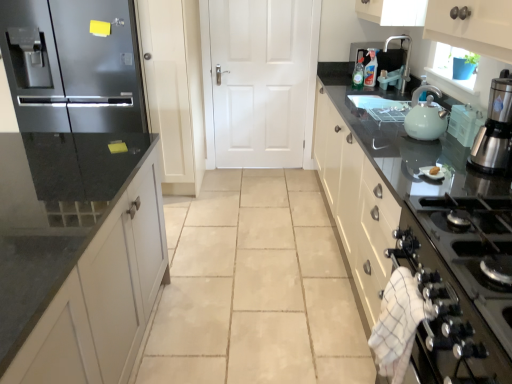
Question: Considering the positions of white matte door at center and shiny black countertop at right in the image, is white matte door at center wider or thinner than shiny black countertop at right?

Choices:
 (A) thin
 (B) wide

Answer: (A)

Question: Considering the positions of white matte door at center and shiny black countertop at right in the image, is white matte door at center taller or shorter than shiny black countertop at right?

Choices:
 (A) short
 (B) tall

Answer: (B)

Question: Estimate the real-world distances between objects in this image. Which object is closer to the white matte door at center?

Choices:
 (A) clear plastic bottle at upper center
 (B) stainless steel coffee maker at upper right
 (C) matte white kettle at right
 (D) shiny black countertop at right
 (E) white glossy gas stove at lower right

Answer: (A)

Question: Estimate the real-world distances between objects in this image. Which object is farther from the shiny black countertop at right?

Choices:
 (A) stainless steel coffee maker at upper right
 (B) white glossy gas stove at lower right
 (C) white matte door at center
 (D) matte black refrigerator at left
 (E) matte white kettle at right

Answer: (D)